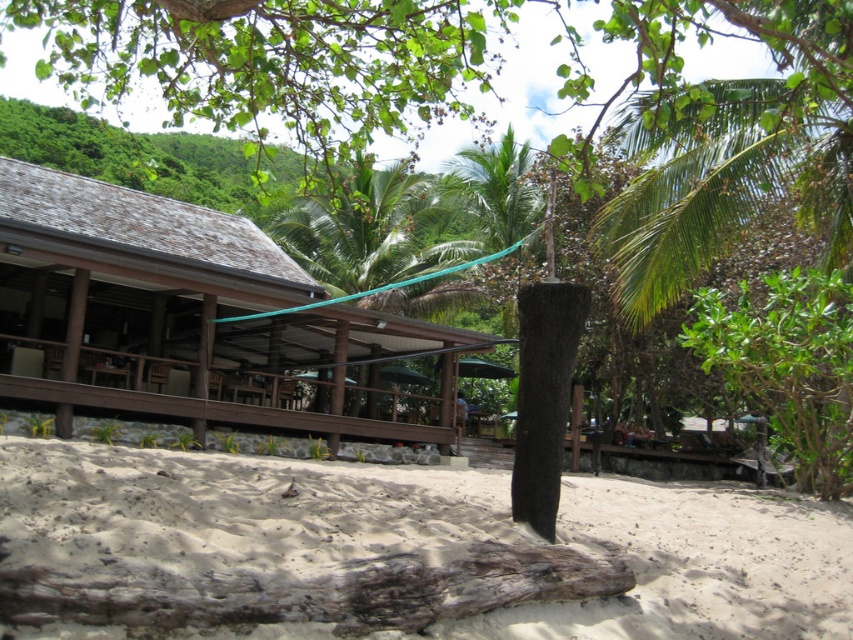
Can you confirm if light brown sandy beach at center is positioned above brown wooden hut at center?

No, light brown sandy beach at center is not above brown wooden hut at center.

Is light brown sandy beach at center wider than brown wooden hut at center?

No, light brown sandy beach at center is not wider than brown wooden hut at center.

What do you see at coordinates (418, 547) in the screenshot? The height and width of the screenshot is (640, 853). I see `light brown sandy beach at center` at bounding box center [418, 547].

Where is `light brown sandy beach at center`? light brown sandy beach at center is located at coordinates point(418,547).

Is light brown sandy beach at center wider than green leafy palm tree at upper center?

Indeed, light brown sandy beach at center has a greater width compared to green leafy palm tree at upper center.

This screenshot has height=640, width=853. In order to click on light brown sandy beach at center in this screenshot , I will do `click(418, 547)`.

At what (x,y) coordinates should I click in order to perform the action: click on light brown sandy beach at center. Please return your answer as a coordinate pair (x, y). Looking at the image, I should click on (418, 547).

Does brown wooden hut at center have a smaller size compared to green leafy palm tree at upper center?

Yes, brown wooden hut at center is smaller than green leafy palm tree at upper center.

The width and height of the screenshot is (853, 640). Find the location of `brown wooden hut at center`. brown wooden hut at center is located at coordinates (187, 316).

I want to click on brown wooden hut at center, so click(x=187, y=316).